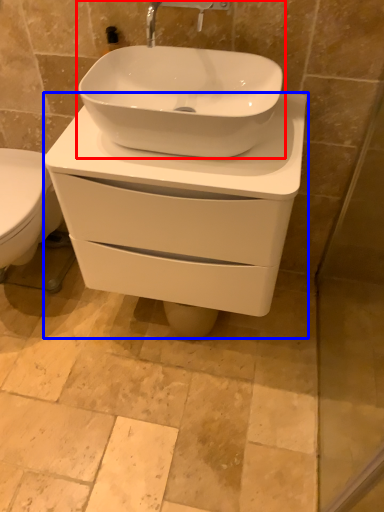
Question: Which point is closer to the camera, sink (highlighted by a red box) or porcelain (highlighted by a blue box)?

Choices:
 (A) sink
 (B) porcelain

Answer: (A)